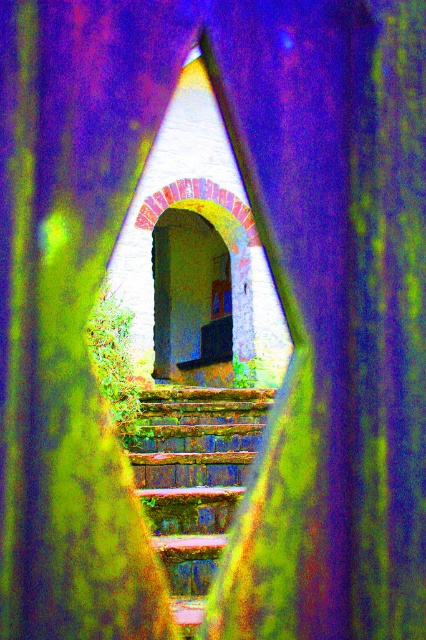
Is rusty metal stairs at center positioned before matte wood balustrade at center?

Yes, it is.

Is rusty metal stairs at center below matte wood balustrade at center?

Yes.

Locate an element on the screen. The image size is (426, 640). rusty metal stairs at center is located at coordinates (193, 480).